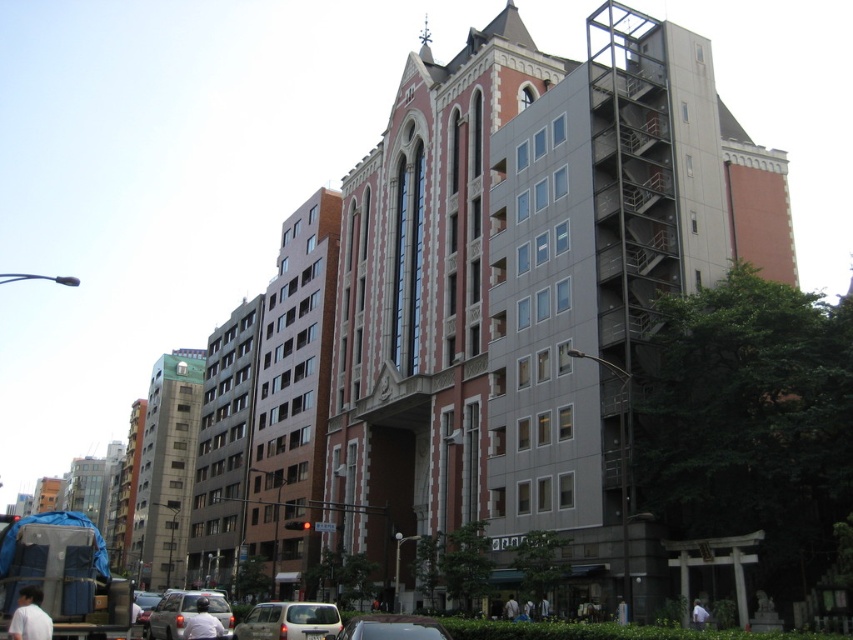
Question: Does matte gray car at lower left have a smaller size compared to white cotton shirt at lower left?

Choices:
 (A) no
 (B) yes

Answer: (A)

Question: Which point is farther to the camera?

Choices:
 (A) white cotton shirt at lower left
 (B) white fabric person at center
 (C) white matte shirt at lower center
 (D) white cotton shirt at lower right

Answer: (B)

Question: Among these points, which one is farthest from the camera?

Choices:
 (A) (505, 604)
 (B) (700, 624)
 (C) (326, 628)
 (D) (200, 600)

Answer: (A)

Question: Is silver metallic car at center to the right of white matte shirt at lower center from the viewer's perspective?

Choices:
 (A) no
 (B) yes

Answer: (B)

Question: Which object appears farthest from the camera in this image?

Choices:
 (A) matte gray car at lower left
 (B) white fabric person at center
 (C) metallic gray scaffolding at right

Answer: (B)

Question: Is white cotton shirt at lower left to the right of white matte shirt at lower center from the viewer's perspective?

Choices:
 (A) yes
 (B) no

Answer: (B)